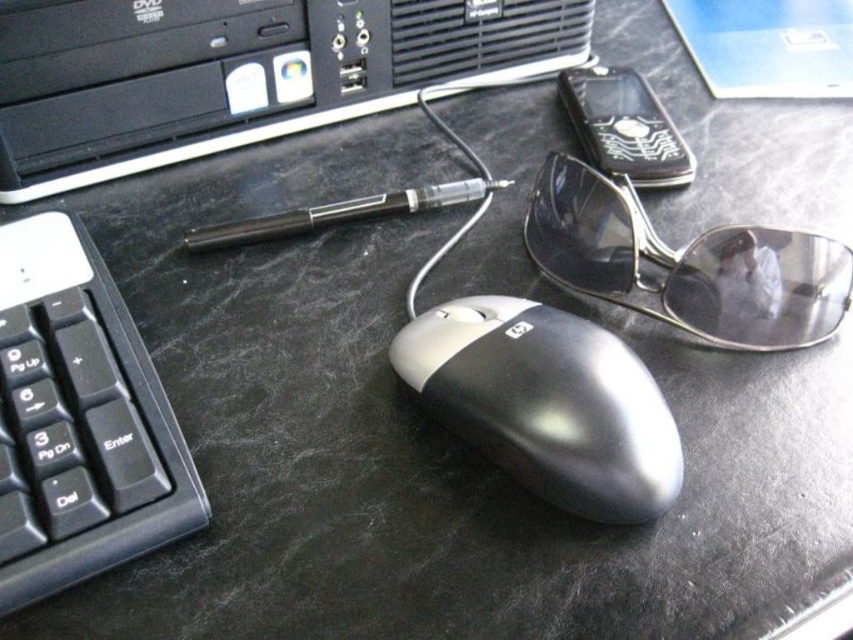
Question: Is black plastic computer tower at upper left to the right of sunglasses at center from the viewer's perspective?

Choices:
 (A) yes
 (B) no

Answer: (B)

Question: Is black plastic computer tower at upper left above sunglasses at center?

Choices:
 (A) no
 (B) yes

Answer: (B)

Question: Which of the following is the closest to the observer?

Choices:
 (A) (747, 300)
 (B) (703, 17)
 (C) (665, 497)
 (D) (260, 20)

Answer: (C)

Question: Which of these objects is positioned farthest from the sunglasses at center?

Choices:
 (A) metallic blue laptop at upper right
 (B) silver/black plastic mouse at center

Answer: (A)

Question: Which point is closer to the camera taking this photo?

Choices:
 (A) click(722, 253)
 (B) click(3, 177)
 (C) click(61, 292)

Answer: (C)

Question: Is black plastic computer tower at upper left to the left of black plastic keyboard at lower left from the viewer's perspective?

Choices:
 (A) no
 (B) yes

Answer: (A)